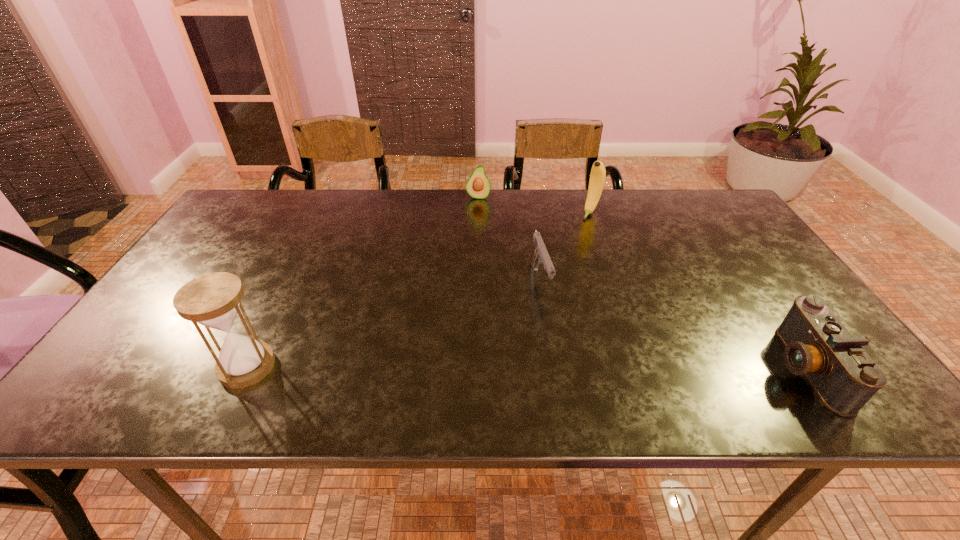
At what (x,y) coordinates should I click in order to perform the action: click on free space between the camera and the fourth object from left to right. Please return your answer as a coordinate pair (x, y). Looking at the image, I should click on (698, 290).

You are a GUI agent. You are given a task and a screenshot of the screen. Output one action in this format:
    pyautogui.click(x=<x>, y=<y>)
    Task: Click on the unoccupied position between the leftmost object and the camera
    This screenshot has height=540, width=960.
    Given the screenshot: What is the action you would take?
    pyautogui.click(x=526, y=367)

This screenshot has height=540, width=960. I want to click on vacant region between the second object from left to right and the banana, so click(x=535, y=205).

Locate an element on the screen. the third closest object relative to the hourglass is located at coordinates (598, 173).

Locate which object ranks second in proximity to the camera. Please provide its 2D coordinates. Your answer should be formatted as a tuple, i.e. [(x, y)], where the tuple contains the x and y coordinates of a point satisfying the conditions above.

[(598, 173)]

Image resolution: width=960 pixels, height=540 pixels. Find the location of `vacant space that satisfies the following two spatial constraints: 1. on the front side of the second object from left to right; 2. on the lens of the rightmost object`. vacant space that satisfies the following two spatial constraints: 1. on the front side of the second object from left to right; 2. on the lens of the rightmost object is located at coordinates (477, 368).